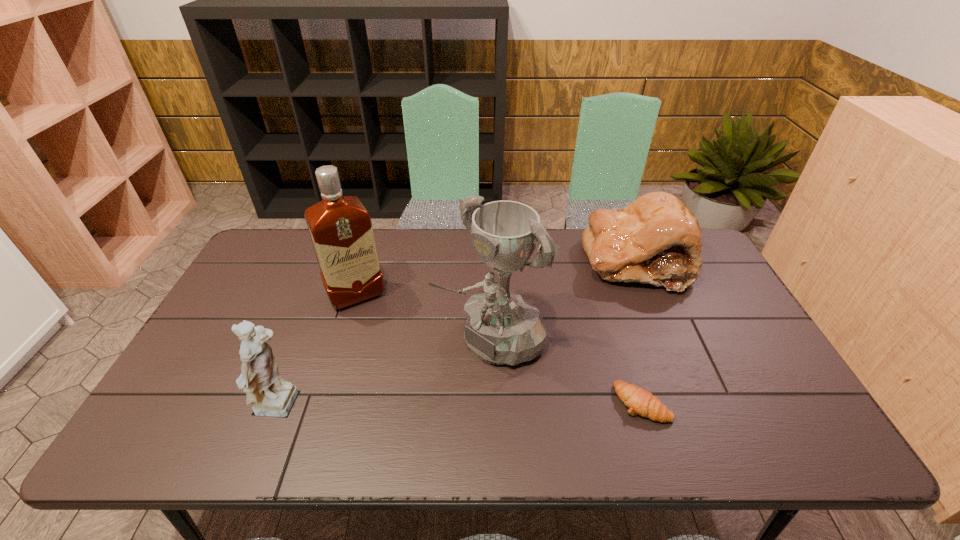
At what (x,y) coordinates should I click in order to perform the action: click on object at the far right corner. Please return your answer as a coordinate pair (x, y). The width and height of the screenshot is (960, 540). Looking at the image, I should click on (656, 239).

Where is `vacant space at the far edge of the desktop`? This screenshot has height=540, width=960. vacant space at the far edge of the desktop is located at coordinates (586, 260).

Locate an element on the screen. vacant region at the near edge is located at coordinates (328, 394).

Find the location of a particular element. The image size is (960, 540). vacant area at the left edge of the desktop is located at coordinates (228, 326).

Locate an element on the screen. This screenshot has width=960, height=540. vacant position at the right edge of the desktop is located at coordinates (744, 360).

Locate an element on the screen. The width and height of the screenshot is (960, 540). vacant space at the far left corner of the desktop is located at coordinates (302, 238).

In the image, there is a desktop. In order to click on free space at the near left corner in this screenshot , I will do `click(191, 407)`.

The image size is (960, 540). Find the location of `free space between the liquor and the figurine`. free space between the liquor and the figurine is located at coordinates (319, 352).

Find the location of a particular element. This screenshot has width=960, height=540. unoccupied position between the second shortest object and the shortest object is located at coordinates (639, 332).

At what (x,y) coordinates should I click in order to perform the action: click on empty space that is in between the shortest object and the award. Please return your answer as a coordinate pair (x, y). The width and height of the screenshot is (960, 540). Looking at the image, I should click on (566, 370).